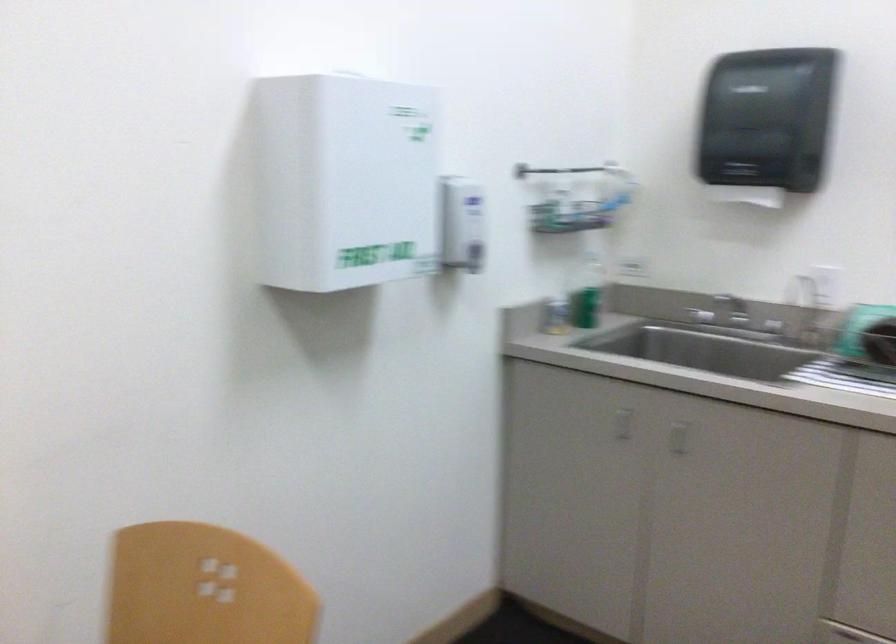
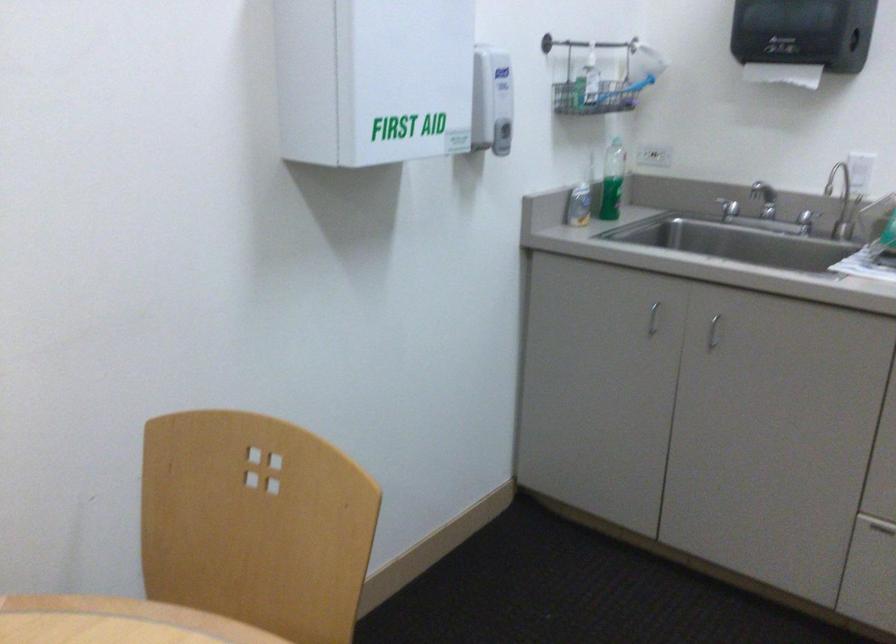
The point at (677, 439) is marked in the first image. Where is the corresponding point in the second image?

(712, 332)